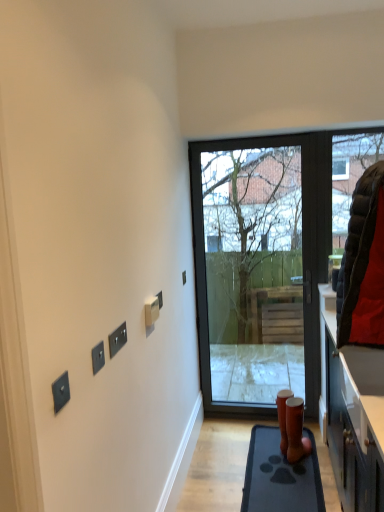
Locate an element on the screen. Image resolution: width=384 pixels, height=512 pixels. black quilted jacket at right is located at coordinates (363, 265).

The height and width of the screenshot is (512, 384). What do you see at coordinates (61, 391) in the screenshot?
I see `satin black switch at lower left, placed as the first electric outlet when sorted from left to right` at bounding box center [61, 391].

What do you see at coordinates (151, 310) in the screenshot?
I see `white plastic electric outlet at center, the 4th electric outlet positioned from the left` at bounding box center [151, 310].

Describe the element at coordinates (280, 476) in the screenshot. I see `rubber mat at lower right` at that location.

Measure the distance between point (x=122, y=342) and camera.

They are 5.35 feet apart.

What do you see at coordinates (117, 339) in the screenshot?
I see `black matte switch at upper center, which is the third electric outlet from front to back` at bounding box center [117, 339].

This screenshot has width=384, height=512. I want to click on black quilted jacket at right, so click(363, 265).

Considering the relative sizes of satin black switch at upper left, the 2th electric outlet in the left-to-right sequence, and satin black switch at lower left, positioned as the 1th electric outlet in front-to-back order, in the image provided, is satin black switch at upper left, the 2th electric outlet in the left-to-right sequence, smaller than satin black switch at lower left, positioned as the 1th electric outlet in front-to-back order,?

Correct, satin black switch at upper left, the 2th electric outlet in the left-to-right sequence, occupies less space than satin black switch at lower left, positioned as the 1th electric outlet in front-to-back order.

From the image's perspective, is satin black switch at upper left, which is counted as the second electric outlet, starting from the front, positioned above or below satin black switch at lower left, the fifth electric outlet positioned from the right?

Clearly, from the image's perspective, satin black switch at upper left, which is counted as the second electric outlet, starting from the front, is above satin black switch at lower left, the fifth electric outlet positioned from the right.

Can you confirm if satin black switch at upper left, marked as the 4th electric outlet in a right-to-left arrangement, is shorter than satin black switch at lower left, marked as the 5th electric outlet in a back-to-front arrangement?

No.

In terms of width, does satin black switch at upper left, marked as the 4th electric outlet in a right-to-left arrangement, look wider or thinner when compared to satin black switch at lower left, the fifth electric outlet positioned from the right?

Considering their sizes, satin black switch at upper left, marked as the 4th electric outlet in a right-to-left arrangement, looks slimmer than satin black switch at lower left, the fifth electric outlet positioned from the right.

Considering the sizes of objects black matte switch at upper center, the 3th electric outlet viewed from the left, and white plastic electric outlet at center, the 4th electric outlet positioned from the left, in the image provided, who is wider, black matte switch at upper center, the 3th electric outlet viewed from the left, or white plastic electric outlet at center, the 4th electric outlet positioned from the left,?

white plastic electric outlet at center, the 4th electric outlet positioned from the left.

Does black matte switch at upper center, the 3th electric outlet viewed from the left, turn towards white plastic electric outlet at center, which is the 2th electric outlet from back to front?

No.

Which of these two, black matte switch at upper center, the 3th electric outlet in the right-to-left sequence, or white plastic electric outlet at center, which is the 2th electric outlet from back to front, is smaller?

black matte switch at upper center, the 3th electric outlet in the right-to-left sequence, is smaller.

Does point (276, 426) come closer to viewer compared to point (123, 343)?

No.

From a real-world perspective, who is located lower, rubber mat at lower right or black matte switch at upper center, the third electric outlet in the back-to-front sequence?

From a 3D spatial view, rubber mat at lower right is below.

Do you think rubber mat at lower right is within black matte switch at upper center, the 3th electric outlet viewed from the left, or outside of it?

rubber mat at lower right is located beyond the bounds of black matte switch at upper center, the 3th electric outlet viewed from the left.

Based on their positions, is rubber mat at lower right located to the left or right of black matte switch at upper center, the third electric outlet in the back-to-front sequence?

Based on their positions, rubber mat at lower right is located to the right of black matte switch at upper center, the third electric outlet in the back-to-front sequence.

From the image's perspective, is black plastic switch at center, the fifth electric outlet from the front, above or below brown matte vase at lower center?

black plastic switch at center, the fifth electric outlet from the front, is above brown matte vase at lower center.

Does black plastic switch at center, arranged as the 1th electric outlet when viewed from the back, have a greater width compared to brown matte vase at lower center?

Incorrect, the width of black plastic switch at center, arranged as the 1th electric outlet when viewed from the back, does not surpass that of brown matte vase at lower center.

Can you confirm if brown matte vase at lower center is wider than rubber mat at lower right?

No, brown matte vase at lower center is not wider than rubber mat at lower right.

Between brown matte vase at lower center and rubber mat at lower right, which one has larger size?

With larger size is rubber mat at lower right.

Between brown matte vase at lower center and rubber mat at lower right, which one appears on the right side from the viewer's perspective?

brown matte vase at lower center.

Is point (290, 453) closer or farther from the camera than point (284, 476)?

Point (290, 453).

Is black matte switch at upper center, the 3th electric outlet in the right-to-left sequence, positioned far away from matte black door at center?

black matte switch at upper center, the 3th electric outlet in the right-to-left sequence, is far away from matte black door at center.

Does point (121, 338) come farther from viewer compared to point (270, 258)?

No.

From the image's perspective, is black matte switch at upper center, the 3th electric outlet in the right-to-left sequence, over matte black door at center?

No, from the image's perspective, black matte switch at upper center, the 3th electric outlet in the right-to-left sequence, is not on top of matte black door at center.

Is black matte switch at upper center, which is the third electric outlet from front to back, smaller than matte black door at center?

Yes, black matte switch at upper center, which is the third electric outlet from front to back, is smaller than matte black door at center.

Which is further, (117, 338) or (291, 452)?

The point (291, 452) is behind.

From a real-world perspective, is black matte switch at upper center, the 3th electric outlet viewed from the left, located higher than brown matte vase at lower center?

Yes, from a real-world perspective, black matte switch at upper center, the 3th electric outlet viewed from the left, is on top of brown matte vase at lower center.

How distant is black matte switch at upper center, the 3th electric outlet viewed from the left, from brown matte vase at lower center?

The distance of black matte switch at upper center, the 3th electric outlet viewed from the left, from brown matte vase at lower center is 1.51 meters.

Can you see black matte switch at upper center, the 3th electric outlet viewed from the left, touching brown matte vase at lower center?

Result: black matte switch at upper center, the 3th electric outlet viewed from the left, is not next to brown matte vase at lower center, and they're not touching.

From the satin black switch at lower left, the fifth electric outlet positioned from the right, count 1st electric outlet to the right and point to it. Please provide its 2D coordinates.

[(98, 357)]

In order to click on the 1st electric outlet below the white plastic electric outlet at center, positioned as the 2th electric outlet in right-to-left order (from the image's perspective) in this screenshot , I will do `click(117, 339)`.

Based on their spatial positions, is black quilted jacket at right or satin black switch at upper left, marked as the 4th electric outlet in a right-to-left arrangement, closer to white plastic electric outlet at center, the fourth electric outlet positioned from the front?

satin black switch at upper left, marked as the 4th electric outlet in a right-to-left arrangement, lies closer to white plastic electric outlet at center, the fourth electric outlet positioned from the front, than the other object.

Estimate the real-world distances between objects in this image. Which object is closer to white plastic electric outlet at center, the fourth electric outlet positioned from the front, matte black door at center or black matte switch at upper center, the 3th electric outlet viewed from the left?

Among the two, black matte switch at upper center, the 3th electric outlet viewed from the left, is located nearer to white plastic electric outlet at center, the fourth electric outlet positioned from the front.

Estimate the real-world distances between objects in this image. Which object is closer to white plastic electric outlet at center, which is the 2th electric outlet from back to front, brown matte vase at lower center or black plastic switch at center, which is the first electric outlet in right-to-left order?

black plastic switch at center, which is the first electric outlet in right-to-left order.

Estimate the real-world distances between objects in this image. Which object is closer to satin black switch at lower left, the fifth electric outlet positioned from the right, black matte switch at upper center, the 3th electric outlet viewed from the left, or satin black switch at upper left, the 4th electric outlet from the back?

The object closer to satin black switch at lower left, the fifth electric outlet positioned from the right, is satin black switch at upper left, the 4th electric outlet from the back.

Estimate the real-world distances between objects in this image. Which object is further from white plastic electric outlet at center, the fourth electric outlet positioned from the front, black plastic switch at center, which is the first electric outlet in right-to-left order, or matte black door at center?

matte black door at center is positioned further to the anchor white plastic electric outlet at center, the fourth electric outlet positioned from the front.

Based on their spatial positions, is black matte switch at upper center, which is the third electric outlet from front to back, or rubber mat at lower right closer to brown matte vase at lower center?

The object closer to brown matte vase at lower center is rubber mat at lower right.

Based on their spatial positions, is white plastic electric outlet at center, positioned as the 2th electric outlet in right-to-left order, or brown matte vase at lower center closer to matte black door at center?

The object closer to matte black door at center is brown matte vase at lower center.

Estimate the real-world distances between objects in this image. Which object is closer to white plastic electric outlet at center, which is the 2th electric outlet from back to front, rubber mat at lower right or satin black switch at lower left, marked as the 5th electric outlet in a back-to-front arrangement?

Among the two, satin black switch at lower left, marked as the 5th electric outlet in a back-to-front arrangement, is located nearer to white plastic electric outlet at center, which is the 2th electric outlet from back to front.

Where is `electric outlet between white plastic electric outlet at center, the fourth electric outlet positioned from the front, and matte black door at center, along the z-axis`? electric outlet between white plastic electric outlet at center, the fourth electric outlet positioned from the front, and matte black door at center, along the z-axis is located at coordinates (160, 298).

I want to click on ramp between black quilted jacket at right and matte black door at center in the front-back direction, so click(x=280, y=476).

Identify the location of electric outlet positioned between black matte switch at upper center, the third electric outlet in the back-to-front sequence, and black plastic switch at center, arranged as the 1th electric outlet when viewed from the back, from near to far. (151, 310).

You are a GUI agent. You are given a task and a screenshot of the screen. Output one action in this format:
    pyautogui.click(x=<x>, y=<y>)
    Task: Click on the vase between white plastic electric outlet at center, positioned as the 2th electric outlet in right-to-left order, and rubber mat at lower right in the up-down direction
    
    Given the screenshot: What is the action you would take?
    pyautogui.click(x=296, y=430)